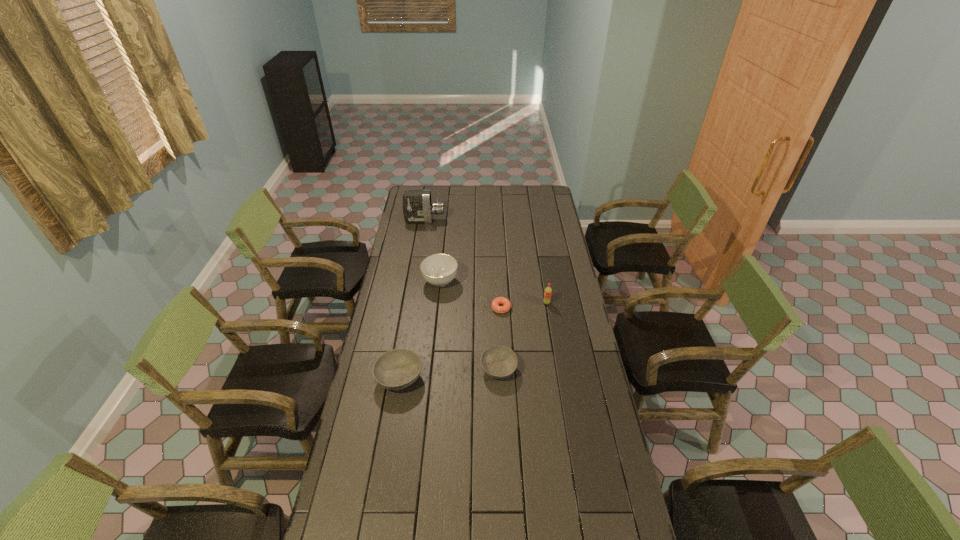
Find the location of a particular element. This screenshot has height=540, width=960. free space between the doughnut and the second shortest object is located at coordinates (500, 339).

At what (x,y) coordinates should I click in order to perform the action: click on unoccupied area between the farthest object and the rightmost object. Please return your answer as a coordinate pair (x, y). The image size is (960, 540). Looking at the image, I should click on (486, 262).

The image size is (960, 540). I want to click on object that is the fifth closest to the doughnut, so click(417, 207).

Locate an element on the screen. The image size is (960, 540). object that is the fourth closest to the rightmost object is located at coordinates (396, 369).

This screenshot has height=540, width=960. I want to click on free space that satisfies the following two spatial constraints: 1. at the front of the camcorder, highlighting the lens; 2. on the left side of the doughnut, so click(x=410, y=308).

You are a GUI agent. You are given a task and a screenshot of the screen. Output one action in this format:
    pyautogui.click(x=<x>, y=<y>)
    Task: Click on the vacant area that satisfies the following two spatial constraints: 1. on the front side of the shortest object; 2. on the left side of the third tallest object
    This screenshot has width=960, height=540.
    Given the screenshot: What is the action you would take?
    pyautogui.click(x=438, y=308)

Find the location of `free space that satisfies the following two spatial constraints: 1. on the back side of the chinaware; 2. on the right side of the fourth tallest object`. free space that satisfies the following two spatial constraints: 1. on the back side of the chinaware; 2. on the right side of the fourth tallest object is located at coordinates (416, 281).

Identify the location of blank area in the image that satisfies the following two spatial constraints: 1. at the front of the camcorder, highlighting the lens; 2. on the left side of the doughnut. (410, 308).

The width and height of the screenshot is (960, 540). I want to click on vacant space that satisfies the following two spatial constraints: 1. on the back side of the taller bowl; 2. on the right side of the soda, so click(412, 303).

This screenshot has height=540, width=960. In order to click on blank space that satisfies the following two spatial constraints: 1. on the back side of the fifth tallest object; 2. on the left side of the third shortest object in this screenshot , I will do `click(401, 369)`.